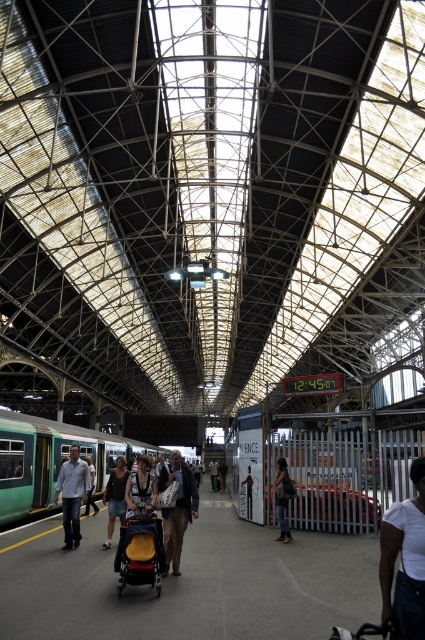
You are a passenger waiting at the train station. You notice a white cotton shirt at lower right and a light blue shirt at left. Which shirt is nearer to you?

The white cotton shirt at lower right is closer to the viewer than the light blue shirt at left.

You are a passenger waiting for the train at the station. You notice a yellow fabric baby carriage at center and a denim jacket at center. Which object is nearer to you?

The yellow fabric baby carriage at center is closer to the viewer than the denim jacket at center.